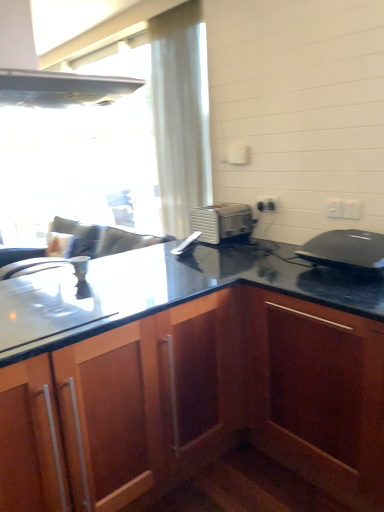
Question: From a real-world perspective, is white plastic electric outlet at upper right, the 1th electric outlet from the front, physically above white plastic electric outlet at upper right, acting as the 3th electric outlet starting from the front?

Choices:
 (A) yes
 (B) no

Answer: (A)

Question: Is white plastic electric outlet at upper right, the 1th electric outlet from the front, smaller than white plastic electric outlet at upper right, placed as the 3th electric outlet when sorted from right to left?

Choices:
 (A) yes
 (B) no

Answer: (A)

Question: Is white plastic electric outlet at upper right, acting as the third electric outlet starting from the back, not inside white plastic electric outlet at upper right, the 1th electric outlet positioned from the left?

Choices:
 (A) no
 (B) yes

Answer: (B)

Question: Does white plastic electric outlet at upper right, which appears as the 3th electric outlet when viewed from the left, contain white plastic electric outlet at upper right, acting as the 3th electric outlet starting from the front?

Choices:
 (A) no
 (B) yes

Answer: (A)

Question: Is white plastic electric outlet at upper right, acting as the third electric outlet starting from the back, taller than white plastic electric outlet at upper right, acting as the 3th electric outlet starting from the front?

Choices:
 (A) yes
 (B) no

Answer: (A)

Question: From the image's perspective, is white plastic electric outlet at upper right, which appears as the 3th electric outlet when viewed from the left, above white plastic electric outlet at upper right, acting as the 3th electric outlet starting from the front?

Choices:
 (A) no
 (B) yes

Answer: (A)

Question: Considering the relative sizes of white plastic electric outlet at upper right, acting as the 2th electric outlet starting from the left, and white sheer curtain at upper left in the image provided, is white plastic electric outlet at upper right, acting as the 2th electric outlet starting from the left, shorter than white sheer curtain at upper left?

Choices:
 (A) yes
 (B) no

Answer: (A)

Question: Is white plastic electric outlet at upper right, which appears as the second electric outlet when viewed from the back, thinner than white sheer curtain at upper left?

Choices:
 (A) yes
 (B) no

Answer: (A)

Question: From the image's perspective, is white plastic electric outlet at upper right, which ranks as the 2th electric outlet in right-to-left order, on top of white sheer curtain at upper left?

Choices:
 (A) yes
 (B) no

Answer: (B)

Question: Is white sheer curtain at upper left surrounded by white plastic electric outlet at upper right, which appears as the 2th electric outlet when viewed from the front?

Choices:
 (A) yes
 (B) no

Answer: (B)

Question: From the image's perspective, is white plastic electric outlet at upper right, which ranks as the 2th electric outlet in right-to-left order, beneath white sheer curtain at upper left?

Choices:
 (A) no
 (B) yes

Answer: (B)

Question: Is white plastic electric outlet at upper right, which ranks as the 2th electric outlet in right-to-left order, oriented towards white sheer curtain at upper left?

Choices:
 (A) no
 (B) yes

Answer: (A)

Question: Does black matte laptop at upper right have a larger size compared to white plastic electric outlet at upper right, which ranks as the 2th electric outlet in right-to-left order?

Choices:
 (A) no
 (B) yes

Answer: (B)